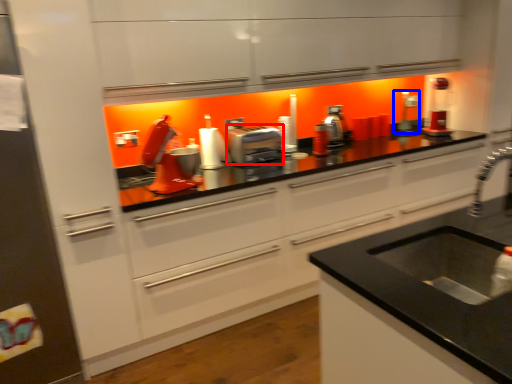
Question: Which of the following is the farthest to the observer, kitchen appliance (highlighted by a red box) or appliance (highlighted by a blue box)?

Choices:
 (A) kitchen appliance
 (B) appliance

Answer: (B)